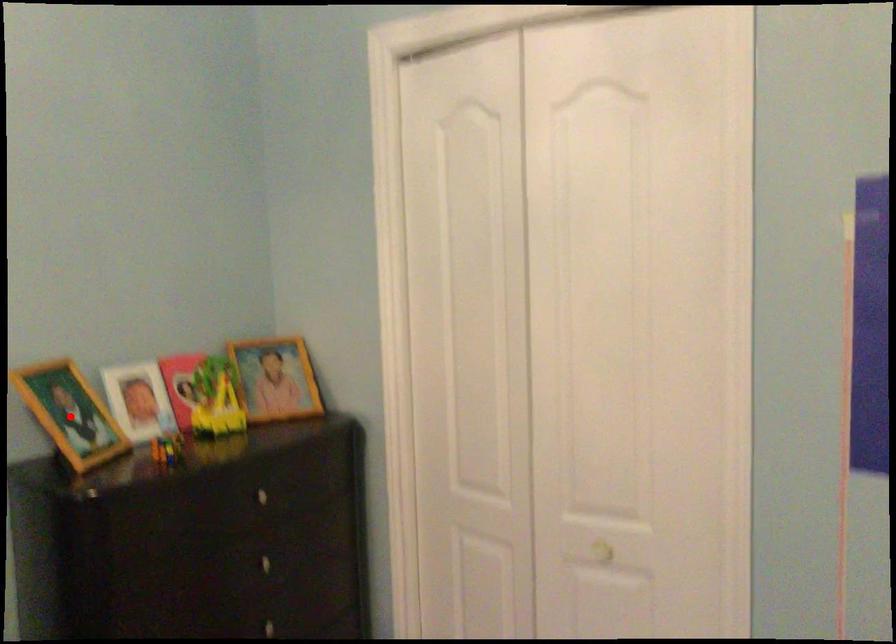
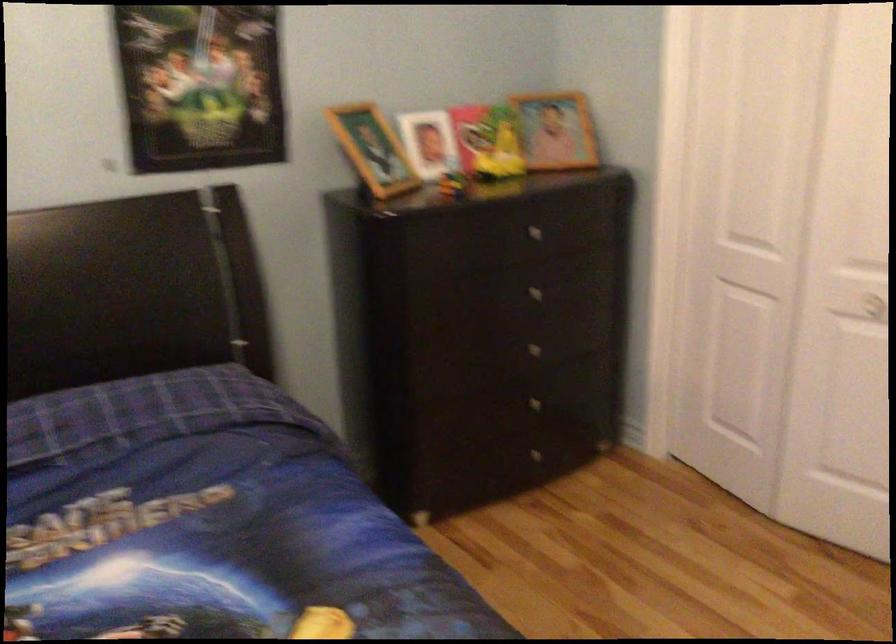
Question: I am providing you with two images of the same scene from different viewpoints. Given a red point in image1, look at the same physical point in image2. Is it:

Choices:
 (A) Closer to the viewpoint
 (B) Farther from the viewpoint

Answer: (B)